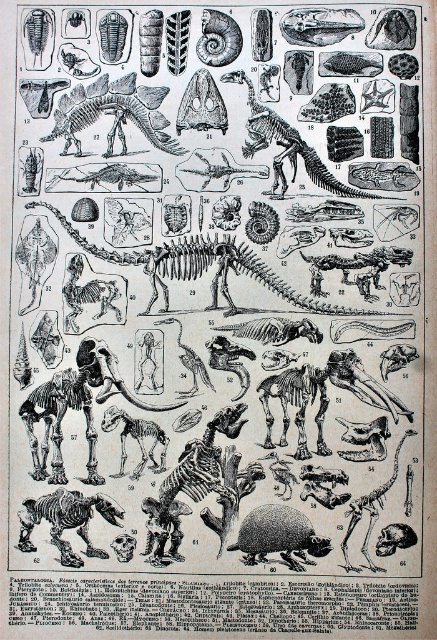
Question: Can you confirm if brown bone-like dinosaur skeleton at lower left is positioned to the left of smooth bone dinosaur at center?

Choices:
 (A) yes
 (B) no

Answer: (A)

Question: Among these points, which one is farthest from the camera?

Choices:
 (A) (79, 522)
 (B) (307, 536)
 (C) (325, 376)

Answer: (A)

Question: Does brown textured armadillo at center appear under smooth bone dinosaur at center?

Choices:
 (A) yes
 (B) no

Answer: (A)

Question: Is brown bone-like dinosaur skeleton at lower left to the left of smooth bone dinosaur at center from the viewer's perspective?

Choices:
 (A) no
 (B) yes

Answer: (B)

Question: Based on their relative distances, which object is farther from the bone-like dinosaur skeleton at upper center?

Choices:
 (A) smooth gray skull at center
 (B) smooth bone dinosaur at center

Answer: (A)

Question: Based on their relative distances, which object is nearer to the brown bone-like dinosaur skeleton at lower left?

Choices:
 (A) bone-like dinosaur skeleton at upper center
 (B) smooth gray skull at center
 (C) brown textured armadillo at center
 (D) smooth bone dinosaur at center

Answer: (C)